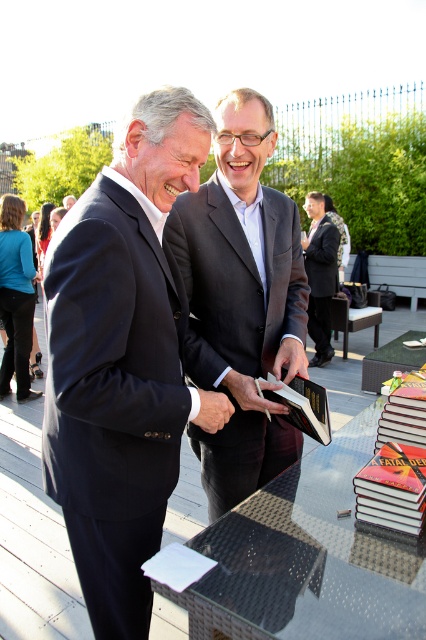
Can you confirm if hardcover book at lower right is positioned below hardcover book at center?

Yes.

Can you confirm if hardcover book at lower right is positioned to the left of hardcover book at center?

No, hardcover book at lower right is not to the left of hardcover book at center.

Identify the location of hardcover book at lower right. The image size is (426, 640). (397, 461).

Is navy blue suit at left smaller than dark gray suit at center?

Indeed, navy blue suit at left has a smaller size compared to dark gray suit at center.

Is navy blue suit at left below dark gray suit at center?

Yes, navy blue suit at left is below dark gray suit at center.

Does point (100, 634) lie behind point (63, 204)?

No, (100, 634) is closer to viewer.

Locate an element on the screen. This screenshot has height=640, width=426. navy blue suit at left is located at coordinates (123, 358).

Between point (267, 266) and point (71, 202), which one is positioned behind?

Point (71, 202)

Is matte black suit at center smaller than dark gray suit at center?

Yes.

Who is more forward, (218, 481) or (71, 198)?

Point (218, 481) is more forward.

The height and width of the screenshot is (640, 426). Identify the location of matte black suit at center. (241, 300).